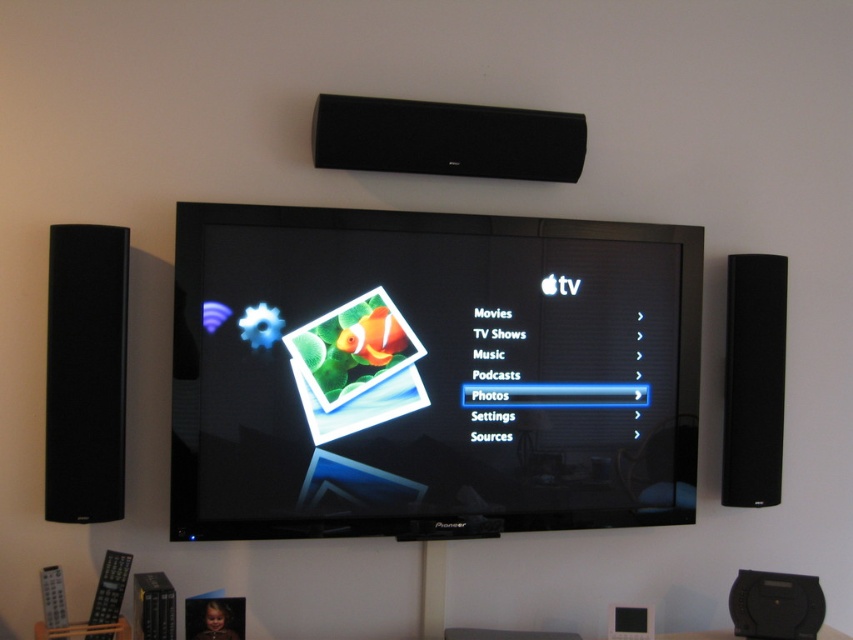
You are a technician adjusting the sound system. You need to check the distance between the black glossy tv at center and the black plastic speaker at lower right. Which one is closer to you?

The black glossy tv at center is closer to the viewer than the black plastic speaker at lower right.

You are setting up a home theater system and need to place the black matte speaker at left and the black matte speaker at right on a shelf. If the left speaker is smaller, which speaker should you place closer to the center of the shelf to balance the setup?

The black matte speaker at left is smaller than the black matte speaker at right. To balance the setup, place the smaller black matte speaker at left closer to the center of the shelf so that the larger speaker at right is positioned further out, maintaining symmetry in the arrangement.

You are setting up a new speaker that is 10 inches wide. You want to place it next to the existing black plastic speaker at lower right without exceeding the space allocated for the black glossy tv at center. Can the new speaker fit alongside the existing one?

The black glossy tv at center is wider than the black plastic speaker at lower right. Since the new speaker is 10 inches wide, it depends on the available space next to the existing speaker. However, the description only states the TV is wider, not the exact dimensions of the speaker. Without specific measurements for the speaker, it is uncertain if the new speaker will fit.